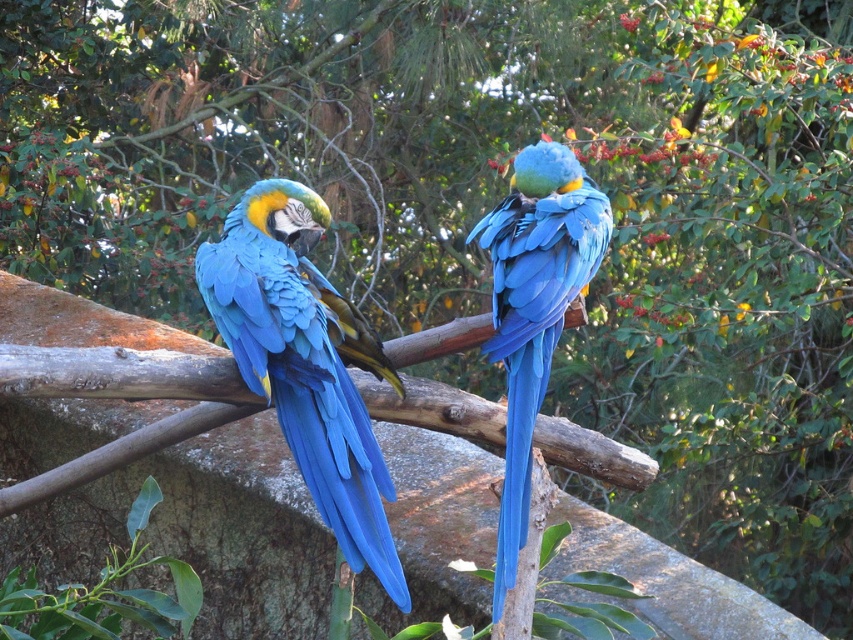
Which is below, blue glossy parrot at left or blue glossy parrot at center?

blue glossy parrot at left

Who is positioned more to the left, blue glossy parrot at left or blue glossy parrot at center?

Positioned to the left is blue glossy parrot at left.

Is point (364, 419) closer to camera compared to point (520, 378)?

That is True.

Find the location of `blue glossy parrot at left`. blue glossy parrot at left is located at coordinates (305, 362).